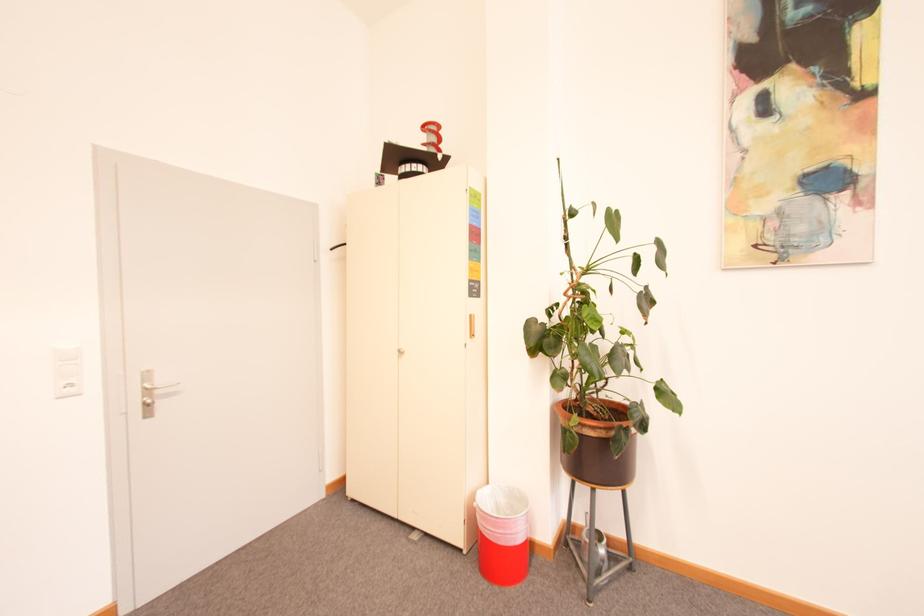
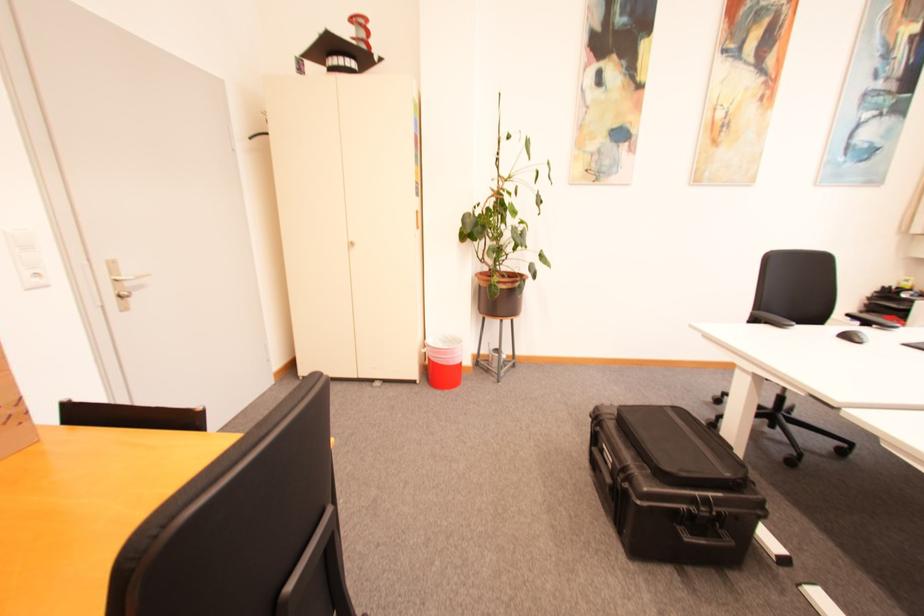
In the second image, find the point that corresponds to [164,392] in the first image.

(134, 285)